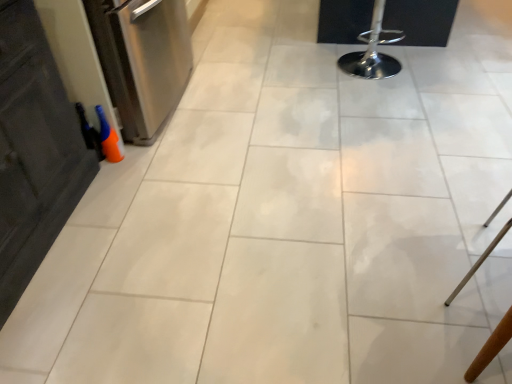
Find the location of a particular element. free point behind wooden chair at lower right is located at coordinates (450, 206).